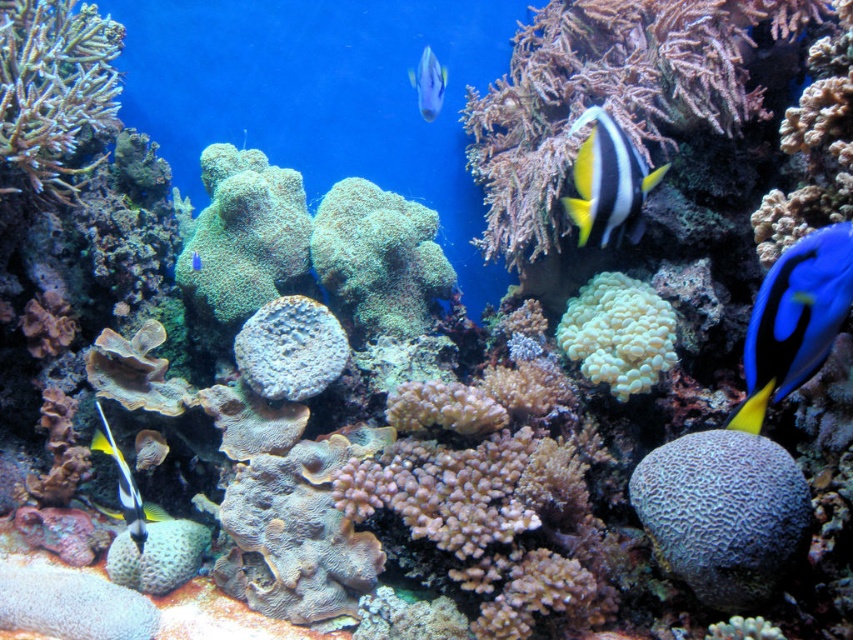
Between blue glossy fish at right and shiny silver fish at upper center, which one is positioned higher?

shiny silver fish at upper center is higher up.

Image resolution: width=853 pixels, height=640 pixels. What do you see at coordinates (793, 320) in the screenshot?
I see `blue glossy fish at right` at bounding box center [793, 320].

What do you see at coordinates (793, 320) in the screenshot? Image resolution: width=853 pixels, height=640 pixels. I see `blue glossy fish at right` at bounding box center [793, 320].

Where is `blue glossy fish at right`? blue glossy fish at right is located at coordinates (793, 320).

Between gray coral at center and black and white striped fish at center-right, which one appears on the left side from the viewer's perspective?

From the viewer's perspective, black and white striped fish at center-right appears more on the left side.

Who is more distant from viewer, (784, 467) or (610, 150)?

Positioned behind is point (610, 150).

Between point (809, 509) and point (566, 205), which one is positioned behind?

The point (566, 205) is more distant.

Find the location of a particular element. This screenshot has width=853, height=640. gray coral at center is located at coordinates (723, 515).

Between blue glossy fish at right and blue glossy fish at center, which one is positioned higher?

Positioned higher is blue glossy fish at center.

Is blue glossy fish at right above blue glossy fish at center?

No.

Which is behind, point (795, 285) or point (194, 268)?

Point (194, 268)

Where is `blue glossy fish at right`? The width and height of the screenshot is (853, 640). blue glossy fish at right is located at coordinates (793, 320).